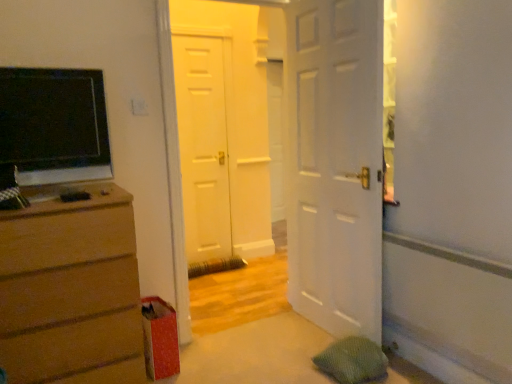
Question: From a real-world perspective, is white matte door at center, placed as the third door when sorted from front to back, physically below matte brown dresser at left?

Choices:
 (A) no
 (B) yes

Answer: (A)

Question: Can you confirm if white matte door at center, the 1th door in the back-to-front sequence, is smaller than matte brown dresser at left?

Choices:
 (A) yes
 (B) no

Answer: (A)

Question: Does white matte door at center, the 1th door in the back-to-front sequence, turn towards matte brown dresser at left?

Choices:
 (A) no
 (B) yes

Answer: (A)

Question: Is white matte door at center, placed as the third door when sorted from front to back, placed right next to matte brown dresser at left?

Choices:
 (A) yes
 (B) no

Answer: (B)

Question: Is white matte door at center, placed as the third door when sorted from front to back, at the left side of matte brown dresser at left?

Choices:
 (A) yes
 (B) no

Answer: (B)

Question: Does white matte door at center, placed as the third door when sorted from front to back, have a greater width compared to matte brown dresser at left?

Choices:
 (A) yes
 (B) no

Answer: (B)

Question: Considering the relative sizes of white matte door at center, the 2th door from the front, and white matte door at center, the 1th door in the front-to-back sequence, in the image provided, is white matte door at center, the 2th door from the front, thinner than white matte door at center, the 1th door in the front-to-back sequence,?

Choices:
 (A) no
 (B) yes

Answer: (A)

Question: From a real-world perspective, is white matte door at center, the 2th door from the front, located beneath white matte door at center, the third door viewed from the back?

Choices:
 (A) yes
 (B) no

Answer: (B)

Question: Would you consider white matte door at center, the 2th door positioned from the back, to be distant from white matte door at center, the third door viewed from the back?

Choices:
 (A) no
 (B) yes

Answer: (B)

Question: Does white matte door at center, the 2th door from the front, appear on the right side of white matte door at center, the third door viewed from the back?

Choices:
 (A) yes
 (B) no

Answer: (B)

Question: From a real-world perspective, is white matte door at center, the 2th door from the front, located higher than white matte door at center, the 1th door in the front-to-back sequence?

Choices:
 (A) no
 (B) yes

Answer: (B)

Question: Is white matte door at center, the 2th door from the front, looking in the opposite direction of white matte door at center, the third door viewed from the back?

Choices:
 (A) yes
 (B) no

Answer: (A)

Question: Is matte brown dresser at left surrounded by white matte door at center, the 2th door positioned from the back?

Choices:
 (A) yes
 (B) no

Answer: (B)